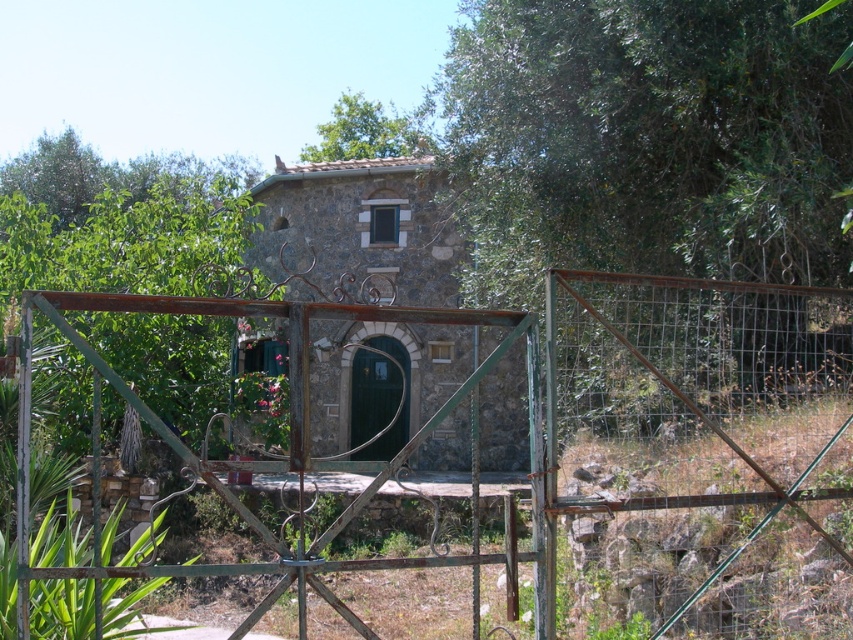
Question: Does rusty metal gate at center have a larger size compared to green matte door at center?

Choices:
 (A) no
 (B) yes

Answer: (A)

Question: Considering the relative positions of rusty metal gate at center and green matte door at center in the image provided, where is rusty metal gate at center located with respect to green matte door at center?

Choices:
 (A) below
 (B) above

Answer: (B)

Question: Which point is closer to the camera taking this photo?

Choices:
 (A) (357, 356)
 (B) (39, 576)

Answer: (B)

Question: Does rusty metal gate at center come in front of green matte door at center?

Choices:
 (A) no
 (B) yes

Answer: (B)